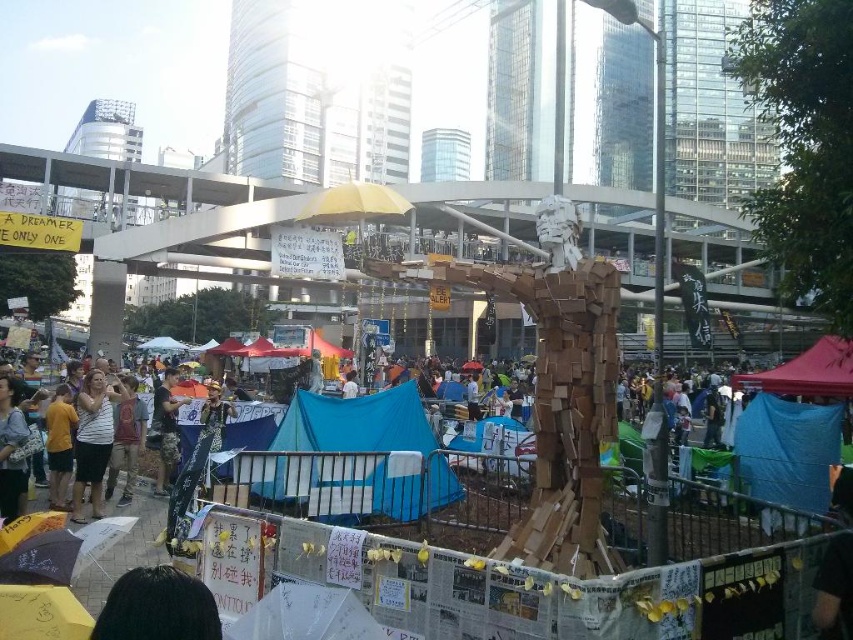
Which is in front, point (109, 417) or point (160, 420)?

Point (109, 417) is more forward.

Identify the location of white striped shirt at center. (93, 440).

Is yellow fabric at lower left below camouflage pants at center?

Incorrect, yellow fabric at lower left is not positioned below camouflage pants at center.

Is yellow fabric at lower left taller than camouflage pants at center?

Yes, yellow fabric at lower left is taller than camouflage pants at center.

Image resolution: width=853 pixels, height=640 pixels. What are the coordinates of `yellow fabric at lower left` in the screenshot? It's located at (59, 444).

Looking at this image, between blue fabric tent at center and red fabric canopy at lower right, which one has less height?

blue fabric tent at center is shorter.

Which is more to the right, blue fabric tent at center or red fabric canopy at lower right?

From the viewer's perspective, red fabric canopy at lower right appears more on the right side.

Where is `blue fabric tent at center`? Image resolution: width=853 pixels, height=640 pixels. blue fabric tent at center is located at coordinates (358, 452).